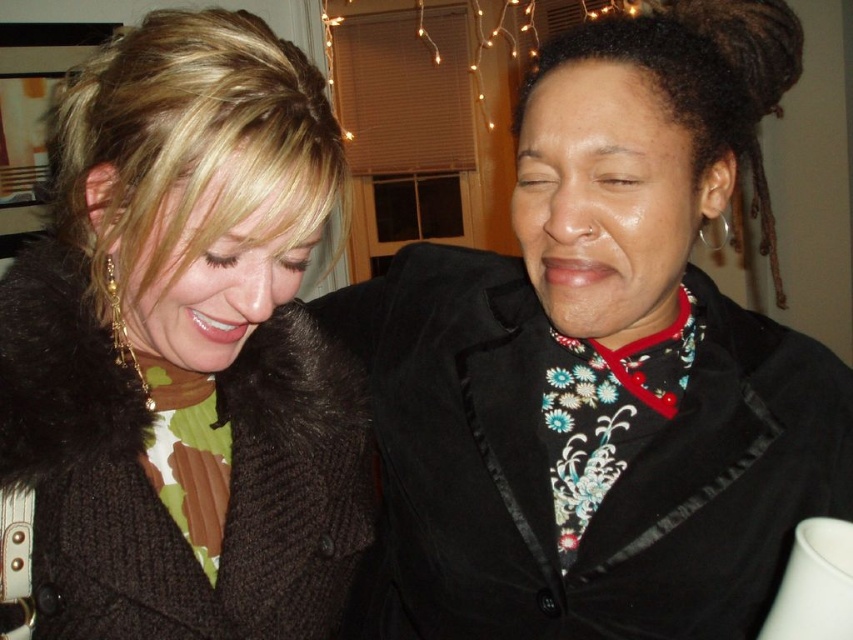
You are a fashion designer observing the image and want to place a new accessory between the velvet black blazer at center and the brown fuzzy coat at left. Based on their positions, which side should you place the accessory to ensure it is between them?

The velvet black blazer at center is to the right of the brown fuzzy coat at left, so placing the accessory to the right of the brown fuzzy coat at left and to the left of the velvet black blazer at center would position it between them.

You are a tailor measuring the distance between two coats for a fitting session. The velvet black blazer at center and the brown fuzzy coat at left are part of the collection. Can you fit a 20 cm wide hanger between them?

The velvet black blazer at center and brown fuzzy coat at left are 21.95 centimeters apart from each other, so yes, a 20 cm wide hanger can fit between them since the space is wider than the hanger.

You are a fashion designer observing the two coats in the image. The velvet black blazer at center and the brown fuzzy coat at left. Which one has a greater height?

The velvet black blazer at center is much taller than the brown fuzzy coat at left, so the velvet black blazer at center has a greater height.